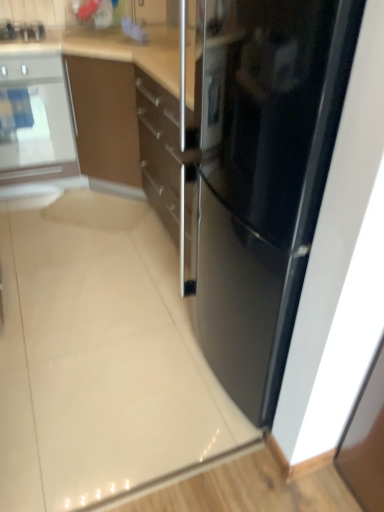
Question: Is brushed metal toaster at upper left oriented towards satin silver oven at left?

Choices:
 (A) no
 (B) yes

Answer: (A)

Question: Are brushed metal toaster at upper left and satin silver oven at left located far from each other?

Choices:
 (A) yes
 (B) no

Answer: (B)

Question: Considering the relative positions of brushed metal toaster at upper left and satin silver oven at left in the image provided, is brushed metal toaster at upper left to the right of satin silver oven at left from the viewer's perspective?

Choices:
 (A) yes
 (B) no

Answer: (A)

Question: Is brushed metal toaster at upper left thinner than satin silver oven at left?

Choices:
 (A) no
 (B) yes

Answer: (B)

Question: Considering the relative sizes of brushed metal toaster at upper left and satin silver oven at left in the image provided, is brushed metal toaster at upper left shorter than satin silver oven at left?

Choices:
 (A) yes
 (B) no

Answer: (A)

Question: Considering the relative positions of brushed metal toaster at upper left and satin silver oven at left in the image provided, is brushed metal toaster at upper left behind satin silver oven at left?

Choices:
 (A) yes
 (B) no

Answer: (A)

Question: Is brushed metal toaster at upper left at the back of satin silver oven at left?

Choices:
 (A) no
 (B) yes

Answer: (A)

Question: From the image's perspective, is satin silver oven at left above brushed metal toaster at upper left?

Choices:
 (A) no
 (B) yes

Answer: (A)

Question: Considering the relative sizes of satin silver oven at left and brushed metal toaster at upper left in the image provided, is satin silver oven at left thinner than brushed metal toaster at upper left?

Choices:
 (A) no
 (B) yes

Answer: (A)

Question: Considering the relative sizes of satin silver oven at left and brushed metal toaster at upper left in the image provided, is satin silver oven at left smaller than brushed metal toaster at upper left?

Choices:
 (A) yes
 (B) no

Answer: (B)

Question: Considering the relative positions of satin silver oven at left and brushed metal toaster at upper left in the image provided, is satin silver oven at left to the left of brushed metal toaster at upper left from the viewer's perspective?

Choices:
 (A) no
 (B) yes

Answer: (B)

Question: Could you tell me if satin silver oven at left is turned towards brushed metal toaster at upper left?

Choices:
 (A) yes
 (B) no

Answer: (B)

Question: Can you confirm if sleek stainless steel refrigerator at center is positioned to the right of satin silver oven at left?

Choices:
 (A) no
 (B) yes

Answer: (B)